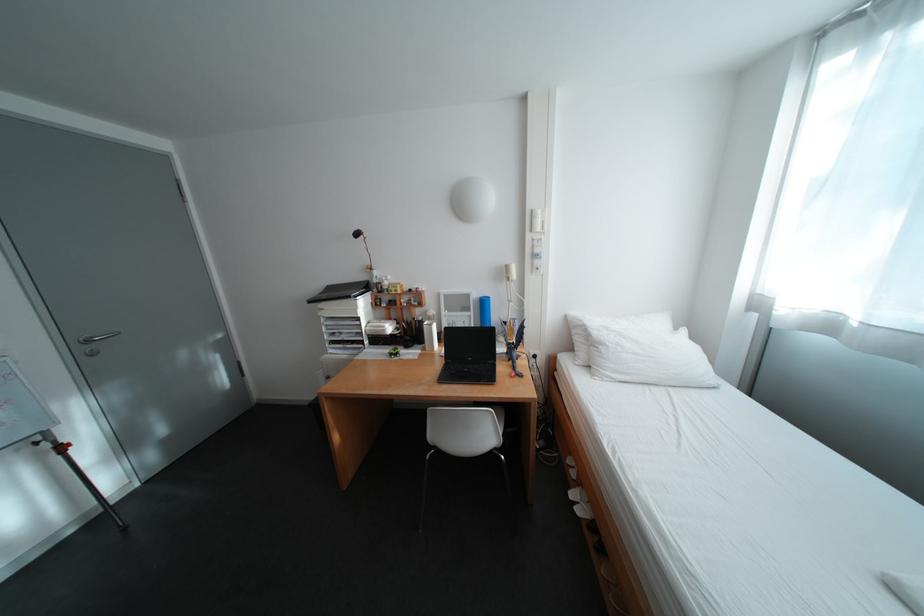
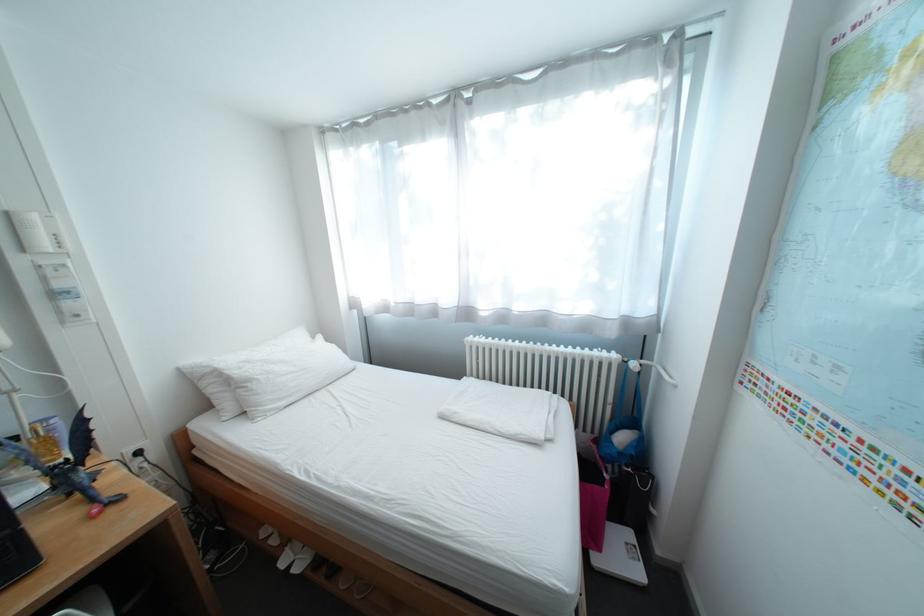
In the second image, find the point that corresponds to pixel 521 361 in the first image.

(81, 495)